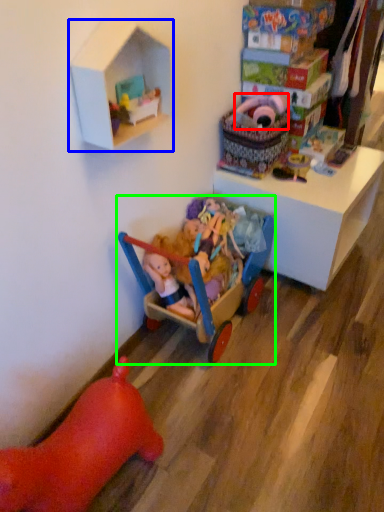
Question: Estimate the real-world distances between objects in this image. Which object is farther from toy (highlighted by a red box), shelf (highlighted by a blue box) or toy (highlighted by a green box)?

Choices:
 (A) shelf
 (B) toy

Answer: (A)